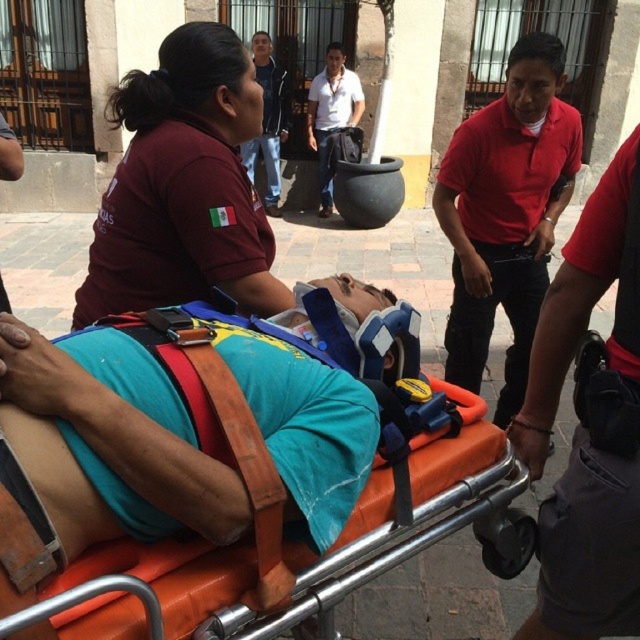
Question: Is red smooth shirt at center below blue jeans at upper center?

Choices:
 (A) no
 (B) yes

Answer: (B)

Question: Which object is the closest to the matte maroon shirt at upper left?

Choices:
 (A) blue jeans at upper center
 (B) white cotton shirt at center
 (C) orange fabric stretcher at center

Answer: (C)

Question: Which point appears farthest from the camera in this image?

Choices:
 (A) (348, 80)
 (B) (278, 449)
 (C) (582, 557)
 (D) (173, 48)

Answer: (A)

Question: Which point appears farthest from the camera in this image?

Choices:
 (A) (282, 108)
 (B) (528, 147)
 (C) (124, 99)

Answer: (A)

Question: Is orange fabric stretcher at center thinner than red smooth shirt at center?

Choices:
 (A) no
 (B) yes

Answer: (A)

Question: Is red smooth shirt at center to the left of red cotton shirt at upper right from the viewer's perspective?

Choices:
 (A) no
 (B) yes

Answer: (B)